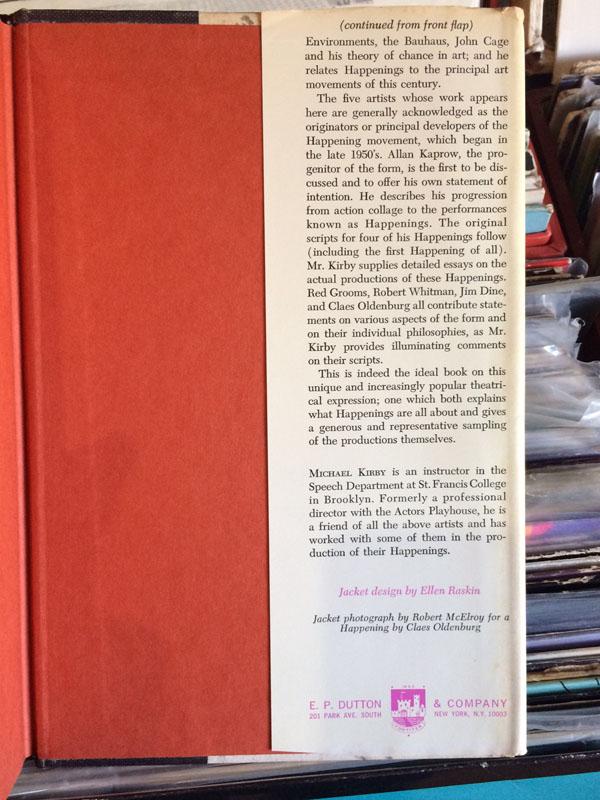
Identify the location of chairs. (571, 166).